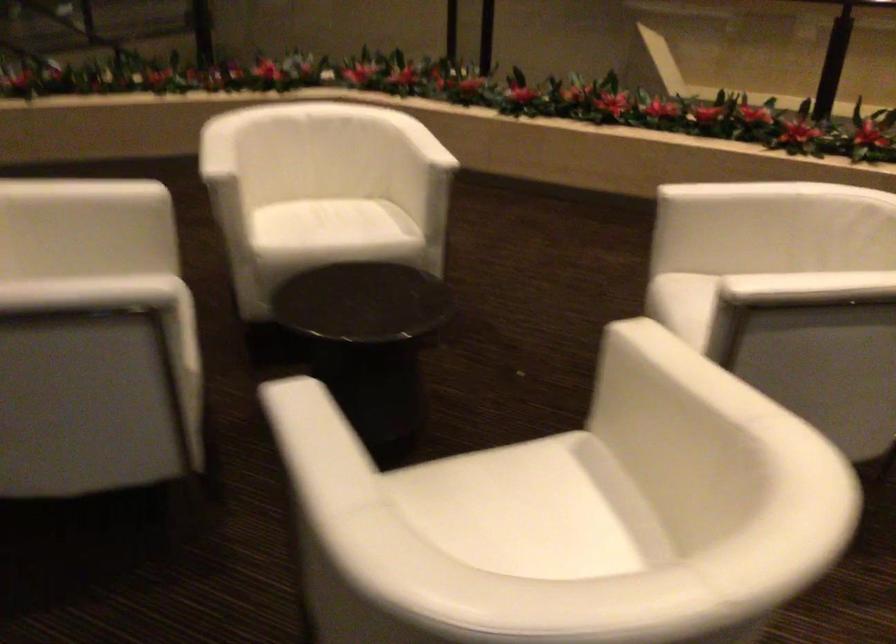
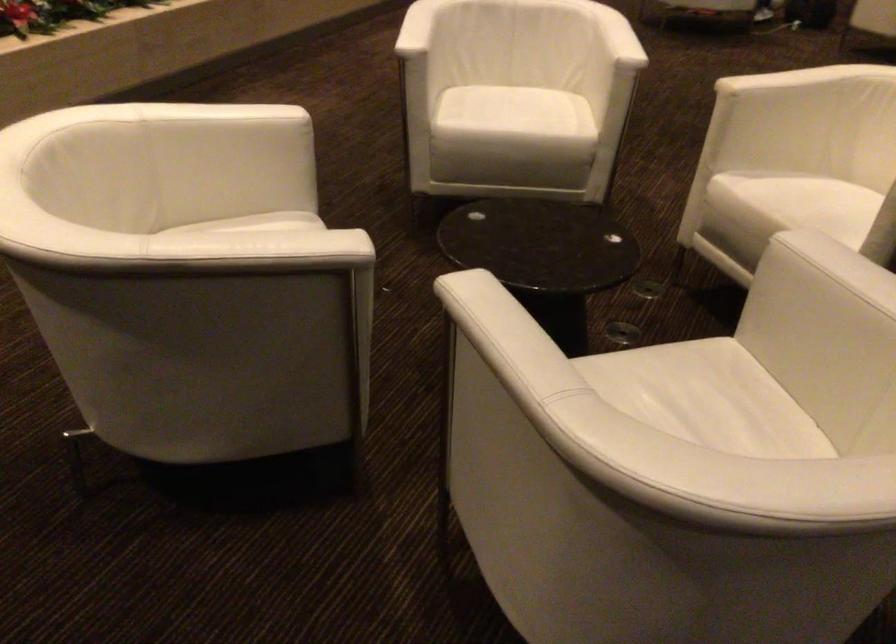
Locate, in the second image, the point that corresponds to point 394,219 in the first image.

(265, 223)